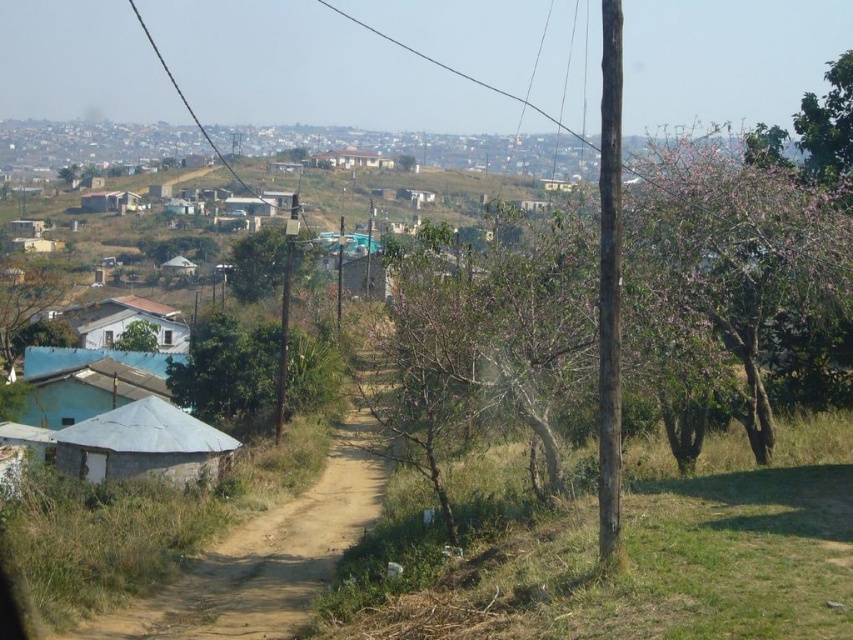
You are standing at point (x=88, y=381) in the rural landscape. What structure can you see at this location?

The blue corrugated metal hut at lower left is located at point (x=88, y=381).

You are a hiker who wants to take a photo of the green leafy tree at center from the white corrugated metal hut at lower left. Can you see the top of the tree from the hut?

The white corrugated metal hut at lower left is not as tall as green leafy tree at center, so the top of the green leafy tree at center would be visible above the hut.

You are a traveler walking along the dirt path in the rural landscape. You notice the blue corrugated metal hut at lower left and the green leafy tree at left. Which object is closer to the dirt path?

The blue corrugated metal hut at lower left is positioned under the green leafy tree at left, so the blue corrugated metal hut at lower left is closer to the dirt path.